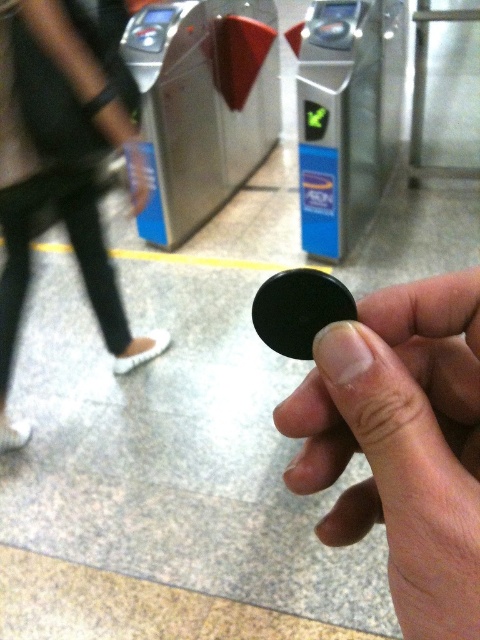
Question: Can you confirm if black matte coin at center is positioned above black leather pants at lower left?

Choices:
 (A) no
 (B) yes

Answer: (A)

Question: Does black matte coin at center have a greater width compared to black leather pants at lower left?

Choices:
 (A) no
 (B) yes

Answer: (A)

Question: Is black matte coin at center bigger than black leather pants at lower left?

Choices:
 (A) no
 (B) yes

Answer: (A)